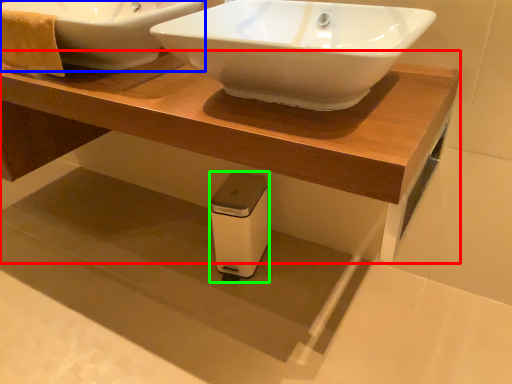
Question: Considering the real-world distances, which object is farthest from table (highlighted by a red box)? sink (highlighted by a blue box) or appliance (highlighted by a green box)?

Choices:
 (A) sink
 (B) appliance

Answer: (B)